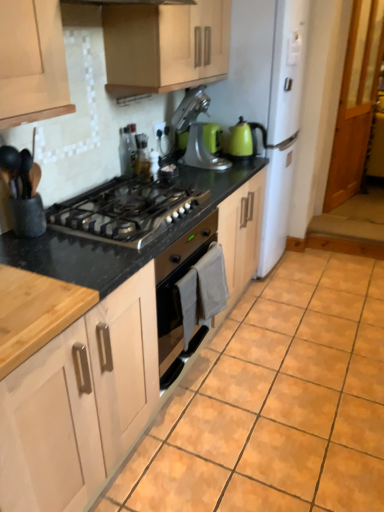
What do you see at coordinates (127, 149) in the screenshot? This screenshot has width=384, height=512. I see `satin silver toaster at upper center, the third appliance viewed from the right` at bounding box center [127, 149].

Measure the distance between point (135, 163) and camera.

The depth of point (135, 163) is 7.18 feet.

This screenshot has height=512, width=384. In order to click on stainless steel gas stove at center in this screenshot , I will do `click(126, 210)`.

What do you see at coordinates (126, 210) in the screenshot?
I see `stainless steel gas stove at center` at bounding box center [126, 210].

I want to click on orange matte tile at center, so click(x=276, y=402).

Identify the location of metallic silver stand mixer at upper center. This screenshot has height=512, width=384. (195, 131).

From their relative heights in the image, would you say natural wood countertop at lower left is taller or shorter than green glossy kettle at upper right?

natural wood countertop at lower left is shorter than green glossy kettle at upper right.

Which is correct: natural wood countertop at lower left is inside green glossy kettle at upper right, or outside of it?

natural wood countertop at lower left is located beyond the bounds of green glossy kettle at upper right.

Is natural wood countertop at lower left in front of green glossy kettle at upper right?

Yes, the depth of natural wood countertop at lower left is less than that of green glossy kettle at upper right.

From a real-world perspective, between natural wood countertop at lower left and green glossy kettle at upper right, who is vertically higher?

green glossy kettle at upper right, from a real-world perspective.

Between point (136, 146) and point (383, 288), which one is positioned in front?

The point (136, 146) is in front.

At what (x,y) coordinates should I click in order to perform the action: click on the 2nd appliance counting from the left side of the orange matte tile at center. Please return your answer as a coordinate pair (x, y). Image resolution: width=384 pixels, height=512 pixels. Looking at the image, I should click on (142, 156).

Who is more distant, translucent glass bottle at upper center, the 2th appliance from the left, or orange matte tile at center?

translucent glass bottle at upper center, the 2th appliance from the left, is further away from the camera.

In the scene shown: Is translucent glass bottle at upper center, the 1th appliance when ordered from front to back, aimed at metallic silver stand mixer at upper center?

No.

Which is farther, (x=149, y=170) or (x=171, y=125)?

Point (x=171, y=125)

Does translucent glass bottle at upper center, the 1th appliance when ordered from front to back, have a lesser width compared to metallic silver stand mixer at upper center?

Correct, the width of translucent glass bottle at upper center, the 1th appliance when ordered from front to back, is less than that of metallic silver stand mixer at upper center.

Is the depth of translucent glass bottle at upper center, which is counted as the 3th appliance, starting from the back, less than that of metallic silver stand mixer at upper center?

Yes.

Considering the sizes of objects satin silver toaster at upper center, the 2th appliance from the back, and natural wood cabinet doors at lower left, which is counted as the 2th cabinetry, starting from the top, in the image provided, who is taller, satin silver toaster at upper center, the 2th appliance from the back, or natural wood cabinet doors at lower left, which is counted as the 2th cabinetry, starting from the top,?

With more height is natural wood cabinet doors at lower left, which is counted as the 2th cabinetry, starting from the top.

Does satin silver toaster at upper center, the 2th appliance from the front, have a lesser width compared to natural wood cabinet doors at lower left, which is counted as the 2th cabinetry, starting from the top?

Indeed, satin silver toaster at upper center, the 2th appliance from the front, has a lesser width compared to natural wood cabinet doors at lower left, which is counted as the 2th cabinetry, starting from the top.

Would you say satin silver toaster at upper center, the third appliance viewed from the right, is a long distance from natural wood cabinet doors at lower left, which appears as the first cabinetry when ordered from the bottom?

Indeed, satin silver toaster at upper center, the third appliance viewed from the right, is not near natural wood cabinet doors at lower left, which appears as the first cabinetry when ordered from the bottom.

Is natural wood cabinet doors at lower left, which appears as the first cabinetry when ordered from the bottom, located within satin silver toaster at upper center, placed as the 1th appliance when sorted from left to right?

No, natural wood cabinet doors at lower left, which appears as the first cabinetry when ordered from the bottom, is not a part of satin silver toaster at upper center, placed as the 1th appliance when sorted from left to right.

Does stainless steel gas stove at center turn towards matte wood cabinet at upper center, placed as the 1th cabinetry when sorted from top to bottom?

No, stainless steel gas stove at center does not turn towards matte wood cabinet at upper center, placed as the 1th cabinetry when sorted from top to bottom.

Is stainless steel gas stove at center further to camera compared to matte wood cabinet at upper center, placed as the 1th cabinetry when sorted from top to bottom?

No, stainless steel gas stove at center is in front of matte wood cabinet at upper center, placed as the 1th cabinetry when sorted from top to bottom.

Is stainless steel gas stove at center bigger or smaller than matte wood cabinet at upper center, the second cabinetry in the bottom-to-top sequence?

Clearly, stainless steel gas stove at center is smaller in size than matte wood cabinet at upper center, the second cabinetry in the bottom-to-top sequence.

From a real-world perspective, is stainless steel gas stove at center over matte wood cabinet at upper center, placed as the 1th cabinetry when sorted from top to bottom?

No.

Consider the image. Is green glossy kettle at upper right facing away from matte wood cabinet at upper center, the second cabinetry in the bottom-to-top sequence?

green glossy kettle at upper right does not have its back to matte wood cabinet at upper center, the second cabinetry in the bottom-to-top sequence.

Between green glossy kettle at upper right and matte wood cabinet at upper center, placed as the 1th cabinetry when sorted from top to bottom, which one has less height?

green glossy kettle at upper right is shorter.

Is green glossy kettle at upper right in contact with matte wood cabinet at upper center, placed as the 1th cabinetry when sorted from top to bottom?

No, green glossy kettle at upper right is not beside matte wood cabinet at upper center, placed as the 1th cabinetry when sorted from top to bottom.

In the scene shown: From a real-world perspective, which object rests below the other?

In real-world perspective, natural wood countertop at lower left is lower.

Considering the points (174, 120) and (27, 329), which point is behind, point (174, 120) or point (27, 329)?

The point (174, 120) is more distant.

Is metallic silver stand mixer at upper center situated inside natural wood countertop at lower left or outside?

metallic silver stand mixer at upper center is not enclosed by natural wood countertop at lower left.

From the image's perspective, is metallic silver stand mixer at upper center located above or below natural wood countertop at lower left?

metallic silver stand mixer at upper center is situated higher than natural wood countertop at lower left in the image.

Locate an element on the screen. Image resolution: width=384 pixels, height=512 pixels. tea pot behind the natural wood countertop at lower left is located at coordinates (242, 139).

Image resolution: width=384 pixels, height=512 pixels. Identify the location of ceramic tile that is in front of the translucent glass bottle at upper center, the 1th appliance when ordered from front to back. (276, 402).

Estimate the real-world distances between objects in this image. Which object is closer to stainless steel gas stove at center, translucent glass bottle at upper center, the second appliance positioned from the right, or green matte stand mixer at center, the 3th appliance from the left?

translucent glass bottle at upper center, the second appliance positioned from the right.

From the image, which object appears to be farther from orange matte tile at center, matte wood cabinet at upper center, placed as the 1th cabinetry when sorted from top to bottom, or translucent glass bottle at upper center, the second appliance positioned from the right?

Among the two, matte wood cabinet at upper center, placed as the 1th cabinetry when sorted from top to bottom, is located further to orange matte tile at center.

Looking at the image, which one is located further to translucent glass bottle at upper center, which is counted as the 3th appliance, starting from the back, orange matte tile at center or metallic silver stand mixer at upper center?

orange matte tile at center lies further to translucent glass bottle at upper center, which is counted as the 3th appliance, starting from the back, than the other object.

Considering their positions, is natural wood cabinet doors at lower left, which appears as the first cabinetry when ordered from the bottom, positioned further to satin silver toaster at upper center, the 2th appliance from the front, than metallic silver stand mixer at upper center?

natural wood cabinet doors at lower left, which appears as the first cabinetry when ordered from the bottom, is positioned further to the anchor satin silver toaster at upper center, the 2th appliance from the front.

From the image, which object appears to be farther from natural wood cabinet doors at lower left, which is counted as the 2th cabinetry, starting from the top, orange matte tile at center or metallic silver stand mixer at upper center?

Among the two, metallic silver stand mixer at upper center is located further to natural wood cabinet doors at lower left, which is counted as the 2th cabinetry, starting from the top.

Considering their positions, is matte wood cabinet at upper center, the second cabinetry in the bottom-to-top sequence, positioned further to natural wood countertop at lower left than orange matte tile at center?

Among the two, matte wood cabinet at upper center, the second cabinetry in the bottom-to-top sequence, is located further to natural wood countertop at lower left.

When comparing their distances from satin silver toaster at upper center, the third appliance viewed from the right, does green glossy kettle at upper right or orange matte tile at center seem closer?

A: green glossy kettle at upper right.

Considering their positions, is green matte stand mixer at center, the 1th appliance from the back, positioned closer to stainless steel gas stove at center than natural wood countertop at lower left?

Based on the image, natural wood countertop at lower left appears to be nearer to stainless steel gas stove at center.

Locate an element on the screen. This screenshot has height=512, width=384. ceramic tile located between natural wood cabinet doors at lower left, which is counted as the 2th cabinetry, starting from the top, and green glossy kettle at upper right in the depth direction is located at coordinates (276, 402).

I want to click on appliance between satin silver toaster at upper center, the 2th appliance from the front, and metallic silver stand mixer at upper center, so click(142, 156).

Find the location of `kitchen appliance between translucent glass bottle at upper center, the 2th appliance from the left, and green matte stand mixer at center, marked as the 3th appliance in a front-to-back arrangement, from front to back`. kitchen appliance between translucent glass bottle at upper center, the 2th appliance from the left, and green matte stand mixer at center, marked as the 3th appliance in a front-to-back arrangement, from front to back is located at coordinates (195, 131).

Where is `countertop between matte wood cabinet at upper center, the second cabinetry in the bottom-to-top sequence, and natural wood cabinet doors at lower left, which appears as the first cabinetry when ordered from the bottom, vertically`? The height and width of the screenshot is (512, 384). countertop between matte wood cabinet at upper center, the second cabinetry in the bottom-to-top sequence, and natural wood cabinet doors at lower left, which appears as the first cabinetry when ordered from the bottom, vertically is located at coordinates (35, 312).